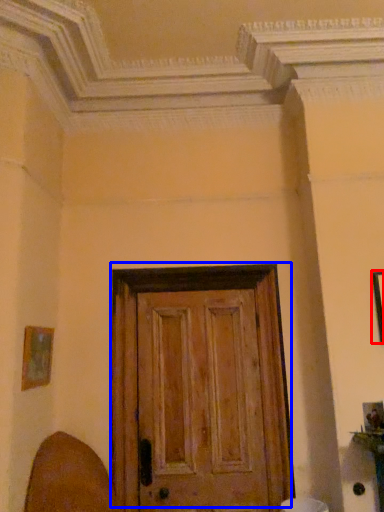
Question: Which object is closer to the camera taking this photo, picture frame (highlighted by a red box) or door (highlighted by a blue box)?

Choices:
 (A) picture frame
 (B) door

Answer: (A)